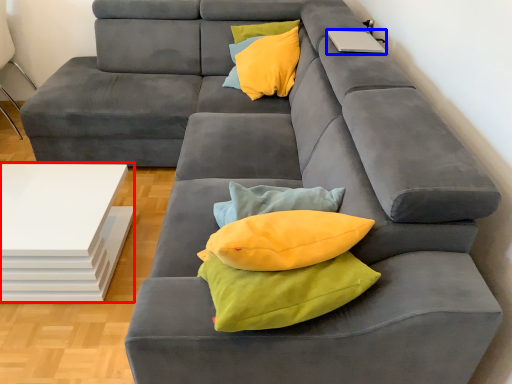
Question: Among these objects, which one is farthest to the camera, table (highlighted by a red box) or laptop (highlighted by a blue box)?

Choices:
 (A) table
 (B) laptop

Answer: (B)